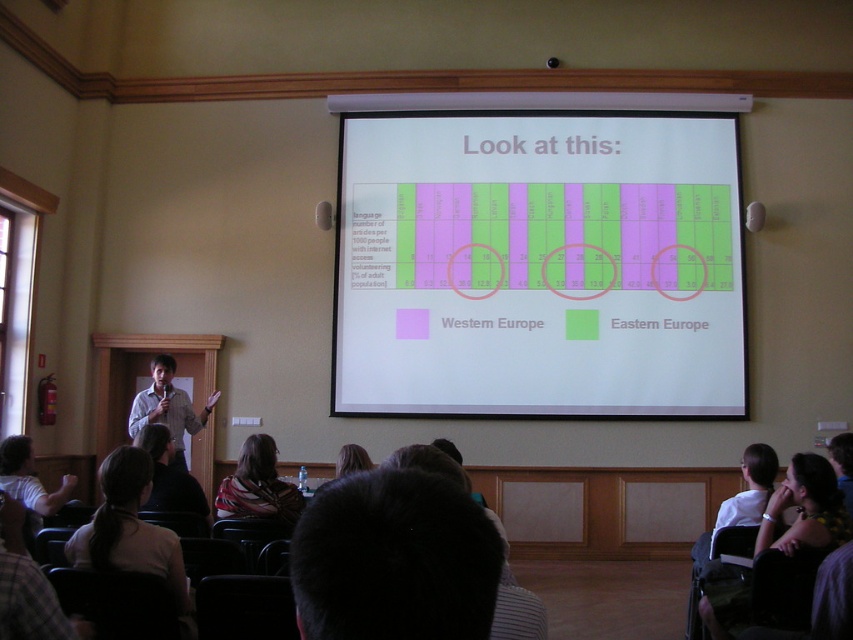
Question: Which object is positioned closest to the light beige fabric chair at lower left?

Choices:
 (A) dark hair at lower right
 (B) brown hair at upper center

Answer: (B)

Question: Which object appears farthest from the camera in this image?

Choices:
 (A) striped scarf at center
 (B) light beige fabric chair at lower left

Answer: (A)

Question: Can you confirm if striped scarf at center is positioned to the left of dark brown leather jacket at lower left?

Choices:
 (A) no
 (B) yes

Answer: (A)

Question: Does dark hair at lower right appear on the right side of striped scarf at center?

Choices:
 (A) no
 (B) yes

Answer: (B)

Question: Observing the image, what is the correct spatial positioning of white matte projection screen at center in reference to light brown hair at lower left?

Choices:
 (A) above
 (B) below

Answer: (A)

Question: Which point is farther from the camera taking this photo?

Choices:
 (A) (407, 342)
 (B) (39, 509)
 (C) (177, 442)

Answer: (A)